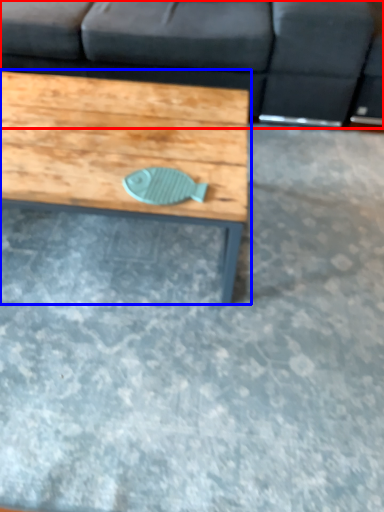
Question: Which object appears closest to the camera in this image, studio couch (highlighted by a red box) or coffee table (highlighted by a blue box)?

Choices:
 (A) studio couch
 (B) coffee table

Answer: (B)